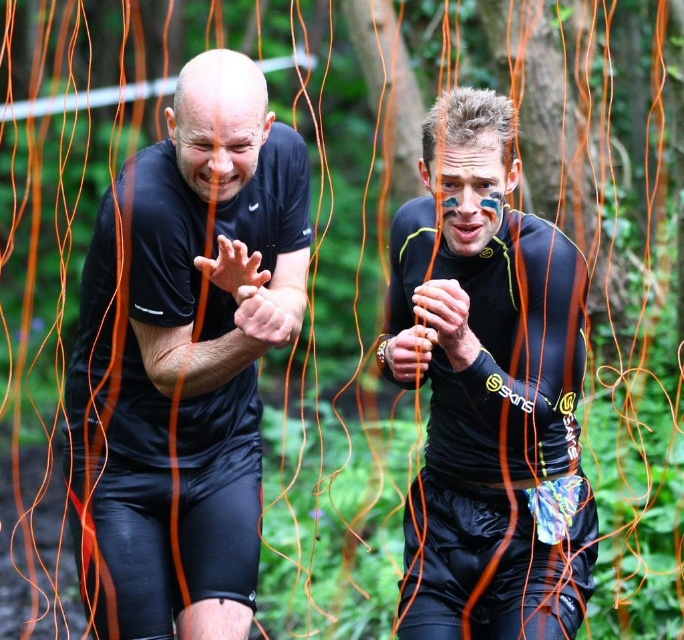
Question: Is black matte shirt at left further to camera compared to matte black running suit at center?

Choices:
 (A) no
 (B) yes

Answer: (B)

Question: Is black matte shirt at left bigger than matte black running suit at center?

Choices:
 (A) yes
 (B) no

Answer: (A)

Question: Which of the following is the farthest from the observer?

Choices:
 (A) matte black running suit at center
 (B) black matte shirt at left

Answer: (B)

Question: Among these points, which one is farthest from the camera?

Choices:
 (A) (215, 214)
 (B) (565, 522)

Answer: (A)

Question: Does black matte shirt at left appear on the right side of matte black running suit at center?

Choices:
 (A) no
 (B) yes

Answer: (A)

Question: Among these points, which one is nearest to the camera?

Choices:
 (A) (94, 257)
 (B) (573, 636)

Answer: (B)